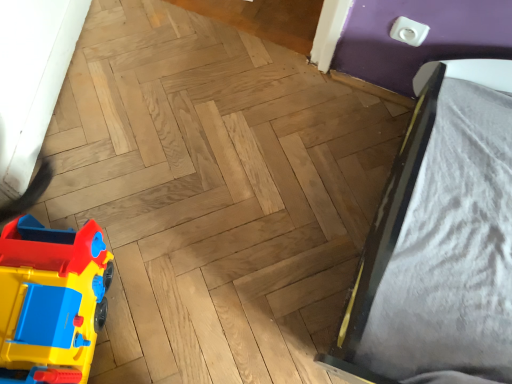
This screenshot has width=512, height=384. I want to click on vacant point to the right of matte plastic toy car at lower left, so click(x=170, y=312).